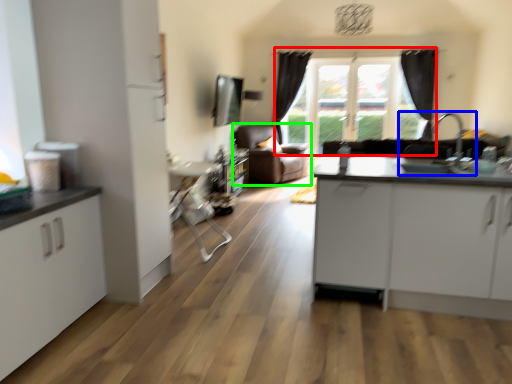
Question: Estimate the real-world distances between objects in this image. Which object is closer to window (highlighted by a red box), sink (highlighted by a blue box) or studio couch (highlighted by a green box)?

Choices:
 (A) sink
 (B) studio couch

Answer: (B)